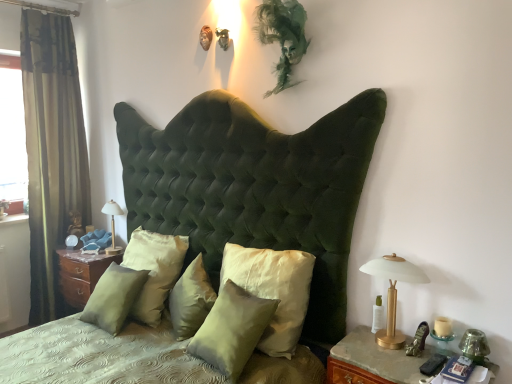
Question: Is satin green pillow at center, the 3th pillow from the right, located outside satin/velvet pillow at center, the fourth pillow from the right?

Choices:
 (A) no
 (B) yes

Answer: (B)

Question: Is satin green pillow at center, the 3th pillow from the right, with satin/velvet pillow at center, which ranks as the 2th pillow in left-to-right order?

Choices:
 (A) yes
 (B) no

Answer: (B)

Question: Is satin green pillow at center, the 3th pillow from the right, at the left side of satin/velvet pillow at center, which ranks as the 2th pillow in left-to-right order?

Choices:
 (A) yes
 (B) no

Answer: (B)

Question: Is satin green pillow at center, the 3th pillow from the right, shorter than satin/velvet pillow at center, which ranks as the 2th pillow in left-to-right order?

Choices:
 (A) yes
 (B) no

Answer: (A)

Question: Is there a large distance between satin green pillow at center, the 3th pillow from the right, and satin/velvet pillow at center, the fourth pillow from the right?

Choices:
 (A) no
 (B) yes

Answer: (A)

Question: From the image's perspective, is satin green pillow at center, the 3th pillow from the right, above satin/velvet pillow at center, the fourth pillow from the right?

Choices:
 (A) yes
 (B) no

Answer: (B)

Question: From a real-world perspective, is green velvet curtain at left positioned over transparent glass window at left based on gravity?

Choices:
 (A) yes
 (B) no

Answer: (B)

Question: Considering the relative positions of green velvet curtain at left and transparent glass window at left in the image provided, is green velvet curtain at left to the left of transparent glass window at left from the viewer's perspective?

Choices:
 (A) yes
 (B) no

Answer: (B)

Question: Can you confirm if green velvet curtain at left is wider than transparent glass window at left?

Choices:
 (A) yes
 (B) no

Answer: (A)

Question: Is green velvet curtain at left oriented towards transparent glass window at left?

Choices:
 (A) yes
 (B) no

Answer: (A)

Question: Considering the relative sizes of green velvet curtain at left and transparent glass window at left in the image provided, is green velvet curtain at left bigger than transparent glass window at left?

Choices:
 (A) yes
 (B) no

Answer: (A)

Question: From the image's perspective, would you say green velvet curtain at left is shown under transparent glass window at left?

Choices:
 (A) yes
 (B) no

Answer: (A)

Question: Is satin green pillow at center, the 3th pillow positioned from the left, bigger than transparent glass window at left?

Choices:
 (A) no
 (B) yes

Answer: (B)